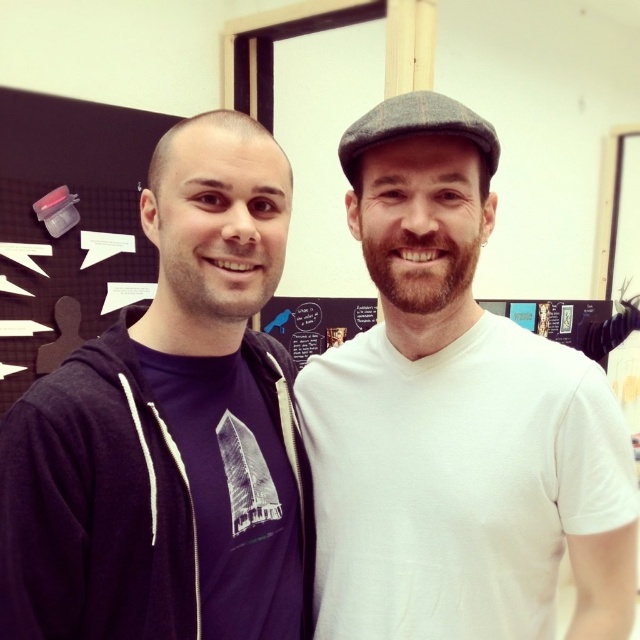
Question: Which object is farther from the camera taking this photo?

Choices:
 (A) white matte cap at upper center
 (B) purple cotton t-shirt at left

Answer: (A)

Question: Is white matte cap at upper center smaller than purple cotton t-shirt at left?

Choices:
 (A) no
 (B) yes

Answer: (A)

Question: Is white matte cap at upper center below purple cotton t-shirt at left?

Choices:
 (A) no
 (B) yes

Answer: (B)

Question: Can you confirm if white matte cap at upper center is positioned above purple cotton t-shirt at left?

Choices:
 (A) yes
 (B) no

Answer: (B)

Question: Which of the following is the closest to the observer?

Choices:
 (A) (609, 467)
 (B) (253, 592)

Answer: (A)